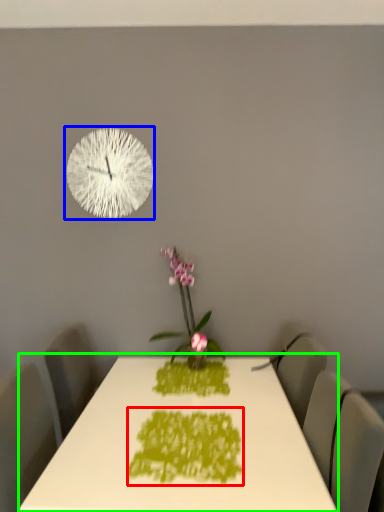
Question: Which object is the farthest from design (highlighted by a red box)? Choose among these: wall clock (highlighted by a blue box) or table (highlighted by a green box).

Choices:
 (A) wall clock
 (B) table

Answer: (A)